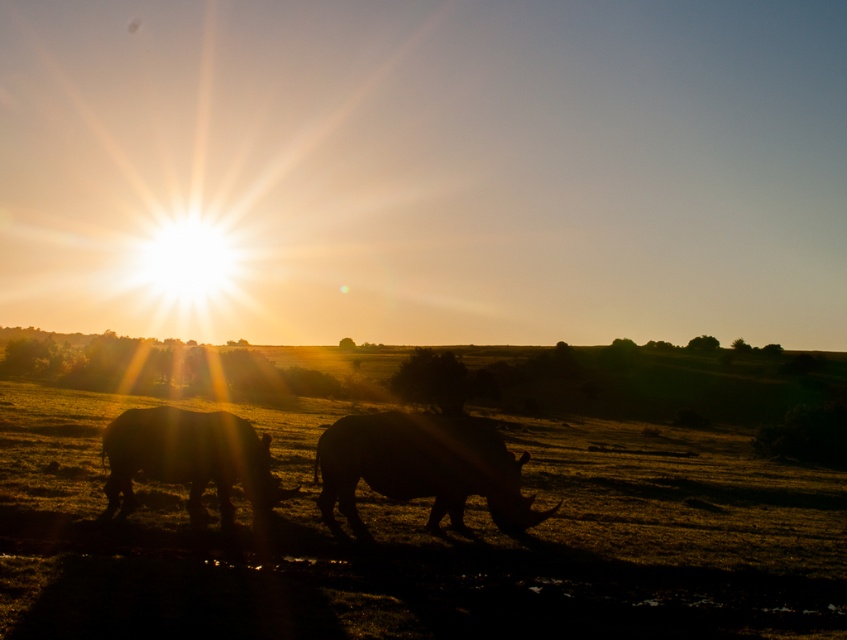
You are a wildlife photographer trying to capture a clear shot of both the silhouette horned at center and the silhouette horned animal at center. Given that your camera can only focus on one subject at a time, which one should you prioritize to ensure it fits entirely within the frame?

The silhouette horned at center is wider than the silhouette horned animal at center, so you should prioritize focusing on the silhouette horned at center to ensure it fits entirely within the frame.

You are a wildlife photographer observing two silhouette horned animals in the foreground of a sunset scene. You notice that one is labeled as the silhouette horned at center and the other as the silhouette horned animal at center. Based on their labels, which one is taller?

The silhouette horned at center is taller than the silhouette horned animal at center.